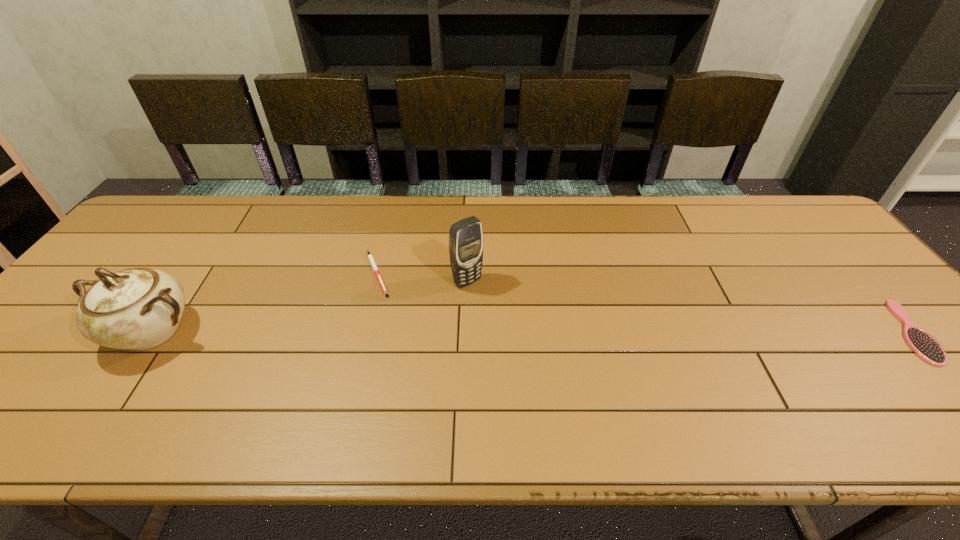
Identify the location of the leftmost object. Image resolution: width=960 pixels, height=540 pixels. (139, 308).

The width and height of the screenshot is (960, 540). I want to click on hairbrush, so click(926, 347).

Find the location of `the second shortest object`. the second shortest object is located at coordinates (926, 347).

Where is `the second object from left to right`? This screenshot has width=960, height=540. the second object from left to right is located at coordinates (370, 257).

This screenshot has height=540, width=960. Identify the location of the shortest object. (370, 257).

The height and width of the screenshot is (540, 960). What are the coordinates of `the second object from right to left` in the screenshot? It's located at click(x=465, y=236).

Where is `vacant space situated 0.330m on the back of the chinaware`? The image size is (960, 540). vacant space situated 0.330m on the back of the chinaware is located at coordinates (226, 224).

Identify the location of free location located 0.110m on the back of the second shortest object. The height and width of the screenshot is (540, 960). (856, 272).

Find the location of a particular element. vacant region located on the clicker of the pen is located at coordinates (501, 348).

Find the location of a particular element. This screenshot has height=540, width=960. vacant space located on the clicker of the pen is located at coordinates (450, 320).